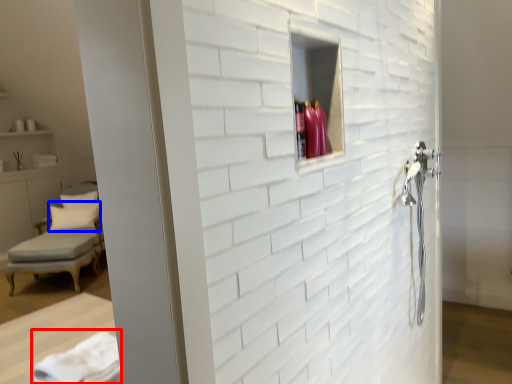
Question: Among these objects, which one is farthest to the camera, bath towel (highlighted by a red box) or pillow (highlighted by a blue box)?

Choices:
 (A) bath towel
 (B) pillow

Answer: (B)